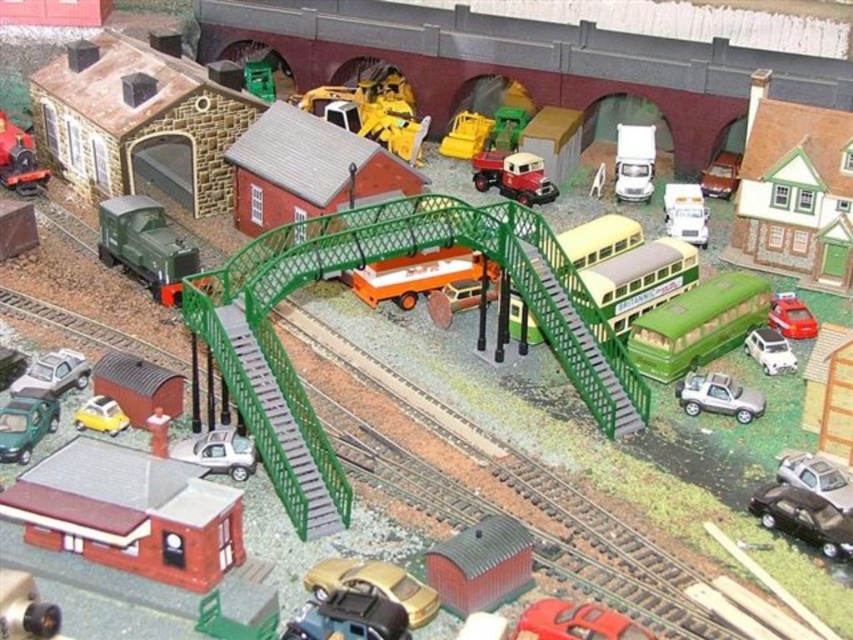
This screenshot has width=853, height=640. What do you see at coordinates (138, 385) in the screenshot? I see `brown matte train car at lower left` at bounding box center [138, 385].

Is brown matte train car at lower left positioned behind shiny red car at center?

Yes, brown matte train car at lower left is further from the viewer.

Describe the element at coordinates (138, 385) in the screenshot. I see `brown matte train car at lower left` at that location.

The height and width of the screenshot is (640, 853). Find the location of `brown matte train car at lower left`. brown matte train car at lower left is located at coordinates (138, 385).

In the scene shown: Which is above, satin silver suv at lower right or white glossy truck at upper center?

white glossy truck at upper center is above.

Is point (720, 396) more distant than point (618, 182)?

No.

Find the location of a particular element. The image size is (853, 640). satin silver suv at lower right is located at coordinates (717, 396).

Does metallic blue car at lower center appear on the left side of shiny red car at center?

Correct, you'll find metallic blue car at lower center to the left of shiny red car at center.

Can you confirm if metallic blue car at lower center is positioned to the right of shiny red car at center?

No, metallic blue car at lower center is not to the right of shiny red car at center.

Who is more distant from viewer, (312,612) or (549,598)?

The point (549,598) is more distant.

Find the location of `metallic blue car at lower center`. metallic blue car at lower center is located at coordinates click(349, 618).